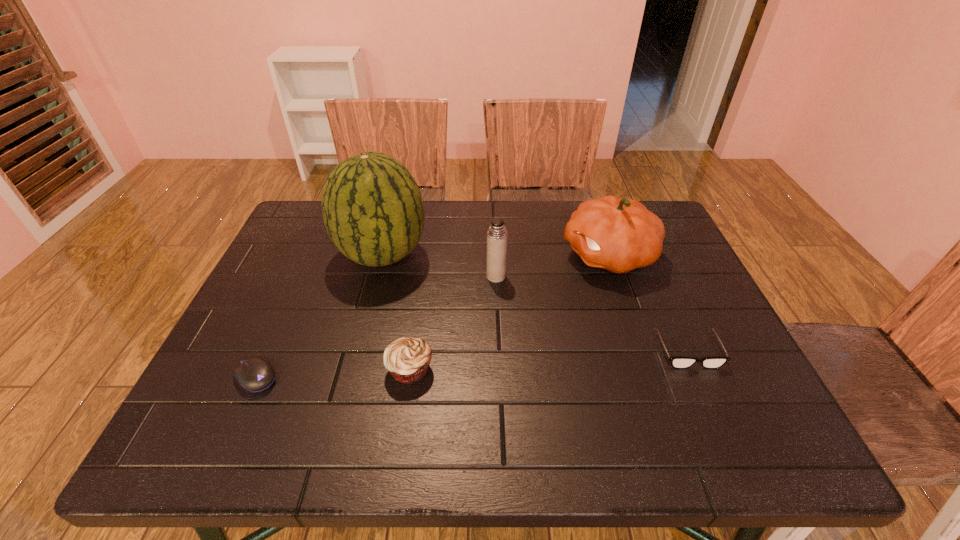
Where is `free location located on the right of the fourth object from left to right`? free location located on the right of the fourth object from left to right is located at coordinates (626, 276).

Where is `vacant space located on the front of the fourth tallest object`? The height and width of the screenshot is (540, 960). vacant space located on the front of the fourth tallest object is located at coordinates (399, 440).

Identify the location of vacant space located on the front-facing side of the spectacles. (711, 402).

You are a GUI agent. You are given a task and a screenshot of the screen. Output one action in this format:
    pyautogui.click(x=<x>, y=<y>)
    Task: Click on the vacant space situated on the right of the leftmost object
    
    Given the screenshot: What is the action you would take?
    pyautogui.click(x=350, y=377)

Locate an element on the screen. watermelon that is at the far edge is located at coordinates (372, 208).

Locate an element on the screen. pumpkin present at the far edge is located at coordinates (619, 235).

You are a GUI agent. You are given a task and a screenshot of the screen. Output one action in this format:
    pyautogui.click(x=<x>, y=<y>)
    Task: Click on the object situated at the left edge
    Image resolution: width=960 pixels, height=540 pixels.
    Given the screenshot: What is the action you would take?
    pyautogui.click(x=254, y=374)

Identify the location of pumpkin at the right edge. (619, 235).

Where is `spectacles that is positioned at the right edge`? spectacles that is positioned at the right edge is located at coordinates (677, 362).

Where is `object that is at the far right corner`? object that is at the far right corner is located at coordinates (619, 235).